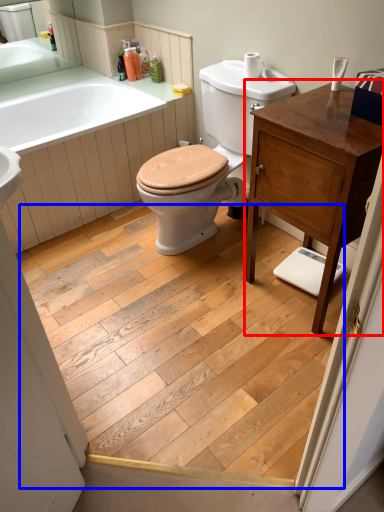
Question: Which point is closer to the camera, bathroom cabinet (highlighted by a red box) or plank (highlighted by a blue box)?

Choices:
 (A) bathroom cabinet
 (B) plank

Answer: (B)